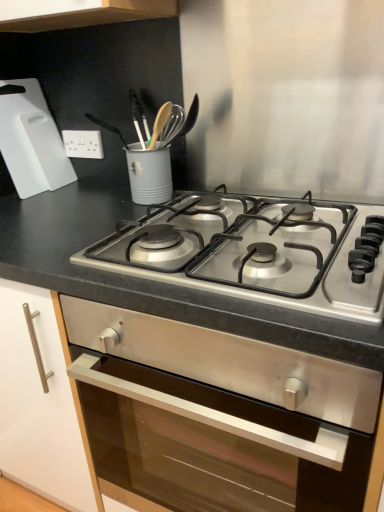
Question: Can you confirm if slate gray countertop at center is taller than white plastic electric outlet at upper left?

Choices:
 (A) yes
 (B) no

Answer: (A)

Question: Can you confirm if slate gray countertop at center is wider than white plastic electric outlet at upper left?

Choices:
 (A) no
 (B) yes

Answer: (B)

Question: Is slate gray countertop at center oriented towards white plastic electric outlet at upper left?

Choices:
 (A) no
 (B) yes

Answer: (A)

Question: Is slate gray countertop at center closer to camera compared to white plastic electric outlet at upper left?

Choices:
 (A) no
 (B) yes

Answer: (B)

Question: Can white plastic electric outlet at upper left be found inside slate gray countertop at center?

Choices:
 (A) yes
 (B) no

Answer: (B)

Question: From the image's perspective, is slate gray countertop at center located above or below white plastic cutting board at upper left?

Choices:
 (A) below
 (B) above

Answer: (A)

Question: Visually, is slate gray countertop at center positioned to the left or to the right of white plastic cutting board at upper left?

Choices:
 (A) left
 (B) right

Answer: (B)

Question: In terms of height, does slate gray countertop at center look taller or shorter compared to white plastic cutting board at upper left?

Choices:
 (A) short
 (B) tall

Answer: (B)

Question: From a real-world perspective, relative to white plastic cutting board at upper left, is slate gray countertop at center vertically above or below?

Choices:
 (A) below
 (B) above

Answer: (A)

Question: From their relative heights in the image, would you say white plastic cutting board at upper left is taller or shorter than stainless steel gas stove at center?

Choices:
 (A) short
 (B) tall

Answer: (B)

Question: Is white plastic cutting board at upper left bigger or smaller than stainless steel gas stove at center?

Choices:
 (A) big
 (B) small

Answer: (B)

Question: Is white plastic cutting board at upper left inside or outside of stainless steel gas stove at center?

Choices:
 (A) outside
 (B) inside

Answer: (A)

Question: In the image, is white plastic cutting board at upper left on the left side or the right side of stainless steel gas stove at center?

Choices:
 (A) right
 (B) left

Answer: (B)

Question: Visually, is slate gray countertop at center positioned to the left or to the right of white plastic electric outlet at upper left?

Choices:
 (A) right
 (B) left

Answer: (A)

Question: Which is correct: slate gray countertop at center is inside white plastic electric outlet at upper left, or outside of it?

Choices:
 (A) outside
 (B) inside

Answer: (A)